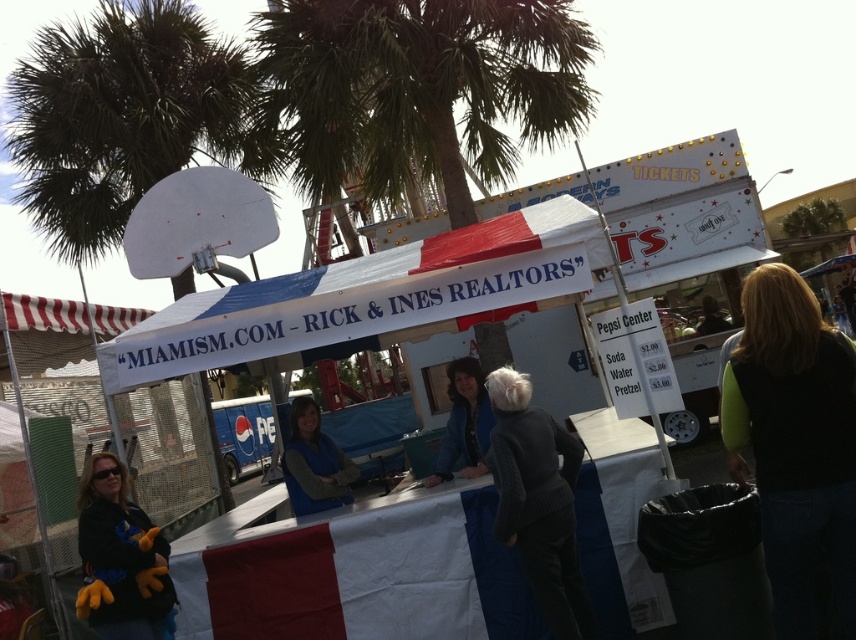
Question: Can you confirm if dark gray sweater at center is smaller than blue fabric vest at center?

Choices:
 (A) yes
 (B) no

Answer: (A)

Question: Is green fleece vest at lower right further to the viewer compared to blue fabric vest at center?

Choices:
 (A) yes
 (B) no

Answer: (B)

Question: Is green leafy palm tree at upper left wider than matte black plush toy at lower left?

Choices:
 (A) yes
 (B) no

Answer: (A)

Question: Which object is closer to the camera taking this photo?

Choices:
 (A) green fleece vest at lower right
 (B) green leafy palm tree at upper left
 (C) dark blue jacket at center
 (D) dark gray sweater at center

Answer: (A)

Question: Which object is positioned closest to the dark blue jacket at center?

Choices:
 (A) matte black plush toy at lower left
 (B) dark gray sweater at center

Answer: (B)

Question: Which object is positioned closest to the green leafy palm tree at upper left?

Choices:
 (A) blue fabric vest at center
 (B) green fleece vest at lower right
 (C) dark gray sweater at center

Answer: (A)